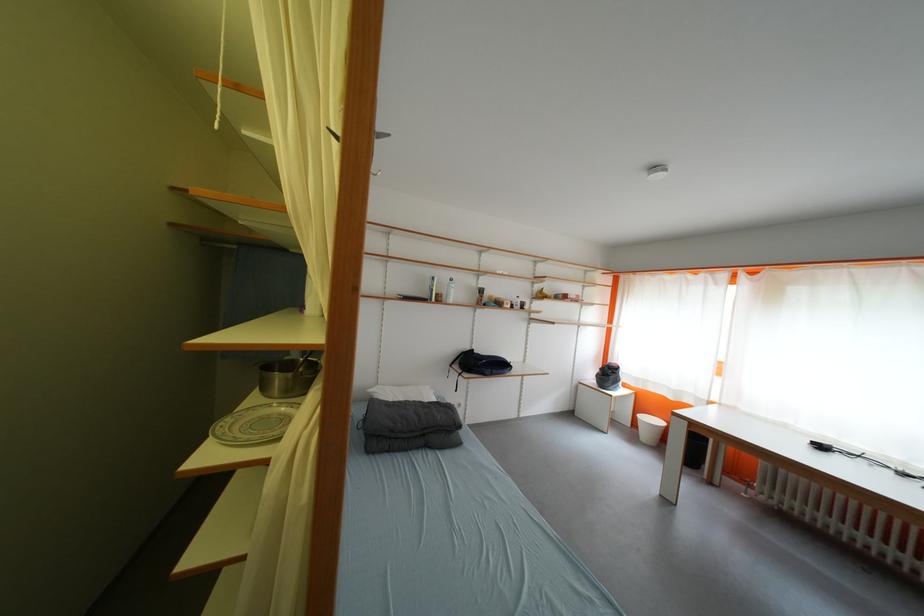
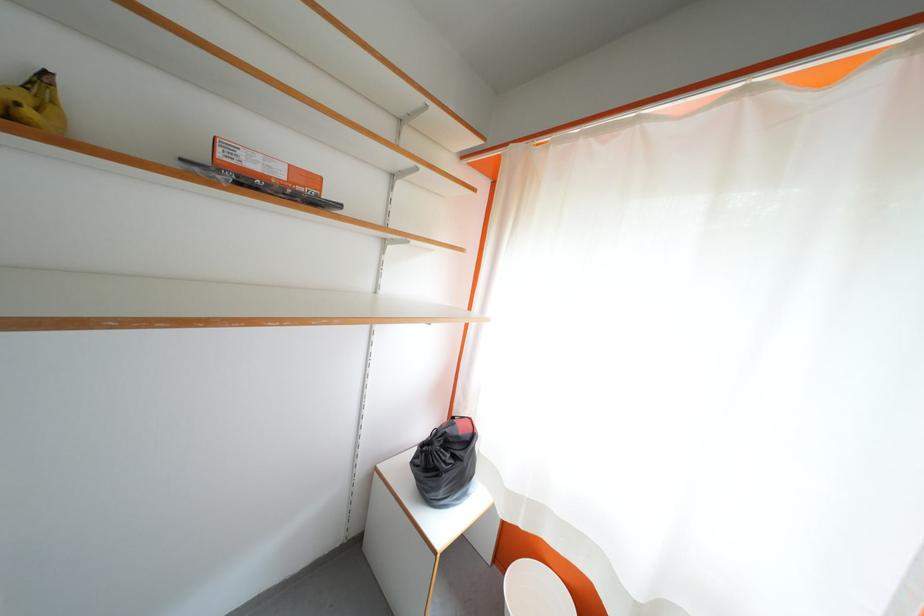
Where in the second image is the point corresponding to [617,378] from the first image?

(455, 460)